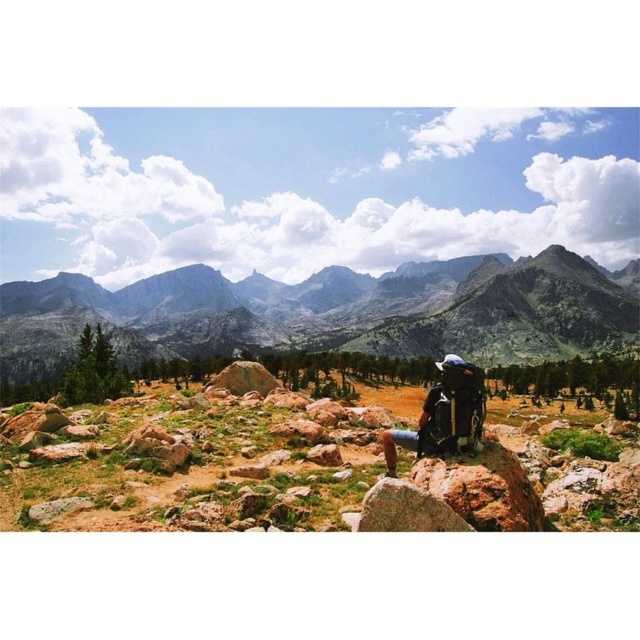
Identify the location of brown rocky terrain at center. This screenshot has width=640, height=640. point(189,460).

From the picture: Who is shorter, brown rocky terrain at center or matte black backpack at center?

matte black backpack at center

Is point (317, 525) more distant than point (483, 394)?

No, (317, 525) is in front of (483, 394).

I want to click on brown rocky terrain at center, so click(189, 460).

Can you confirm if gray rock formation at center is positioned above matte black backpack at center?

Yes.

Measure the distance between gray rock formation at center and camera.

gray rock formation at center and camera are 699.78 feet apart.

Does point (74, 337) lie behind point (442, 381)?

Yes, point (74, 337) is farther from viewer.

This screenshot has width=640, height=640. In order to click on gray rock formation at center in this screenshot , I will do `click(332, 312)`.

Is point (524, 433) positioned in front of point (148, 310)?

Yes, it is.

Between brown rocky terrain at center and gray rock formation at center, which one is positioned lower?

brown rocky terrain at center

Is point (81, 452) positioned after point (381, 332)?

No, it is in front of (381, 332).

You are a GUI agent. You are given a task and a screenshot of the screen. Output one action in this format:
    pyautogui.click(x=<x>, y=<y>)
    Task: Click on the brown rocky terrain at center
    This screenshot has width=640, height=640.
    Given the screenshot: What is the action you would take?
    pyautogui.click(x=189, y=460)